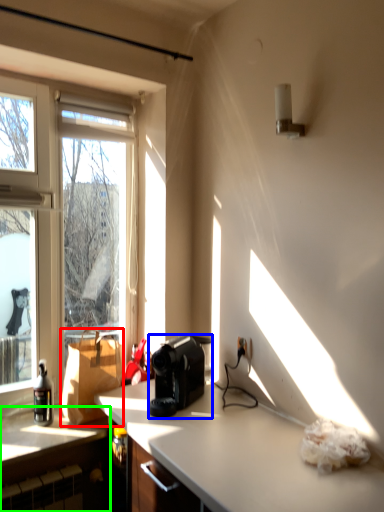
Question: Estimate the real-world distances between objects in this image. Which object is farther from cardboard box (highlighted by a red box), coffee maker (highlighted by a blue box) or cabinetry (highlighted by a green box)?

Choices:
 (A) coffee maker
 (B) cabinetry

Answer: (A)